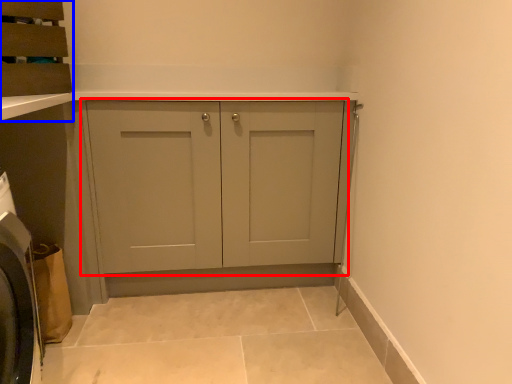
Question: Which of the following is the farthest to the observer, cupboard (highlighted by a red box) or cabinetry (highlighted by a blue box)?

Choices:
 (A) cupboard
 (B) cabinetry

Answer: (A)